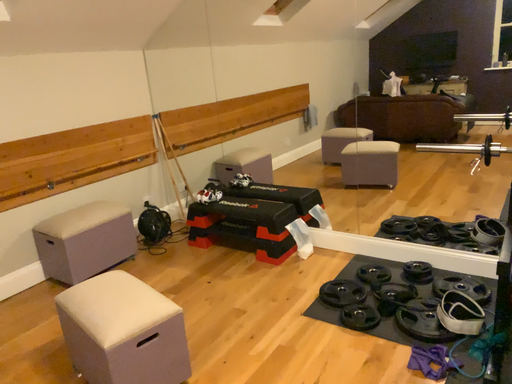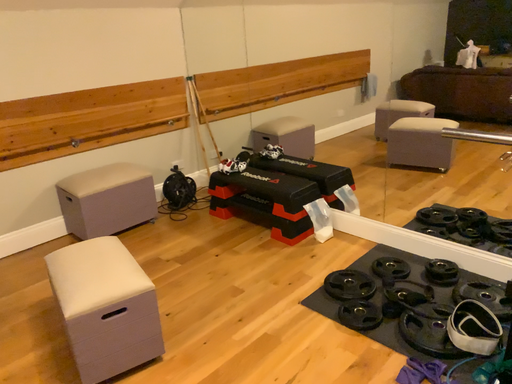
Question: How did the camera likely rotate when shooting the video?

Choices:
 (A) rotated right
 (B) rotated left

Answer: (B)